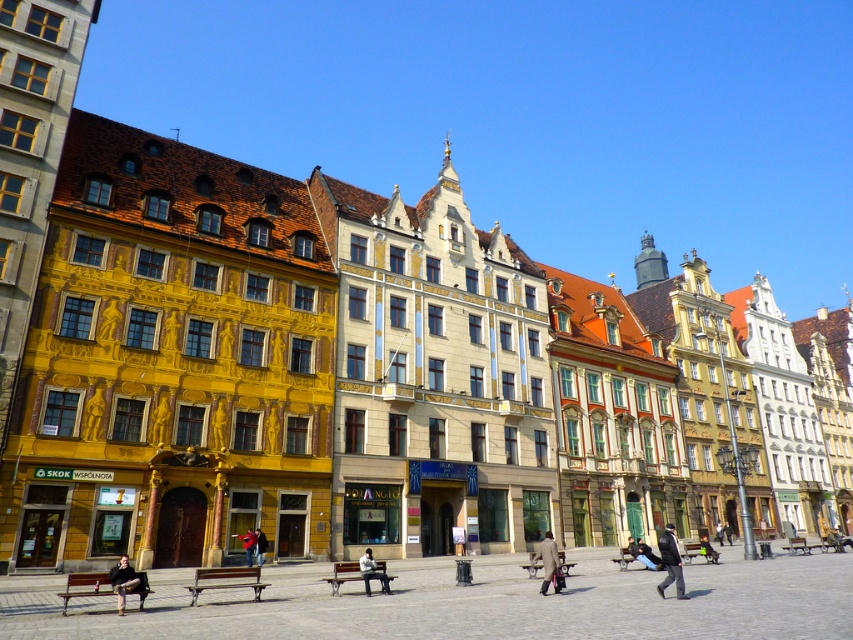
You are standing in the middle of the street looking at the historic buildings. You see a dark brown leather jacket at lower left and a light brown leather coat at lower right. Which one is closer to your left side?

The dark brown leather jacket at lower left is closer to your left side because it is positioned on the left side of the light brown leather coat at lower right.

You are a tailor who needs to determine which jacket to alter first. You have a red leather jacket at center and a red jacket at center in front of you. Which one requires more fabric to adjust its width?

The red leather jacket at center requires more fabric to adjust its width since it is wider than the red jacket at center.

You are a tourist standing in front of the historic buildings. You see a dark brown leather jacket at lower left and a red jacket at center. Which jacket is positioned higher from the ground?

The dark brown leather jacket at lower left is positioned higher from the ground than the red jacket at center because it is above it.